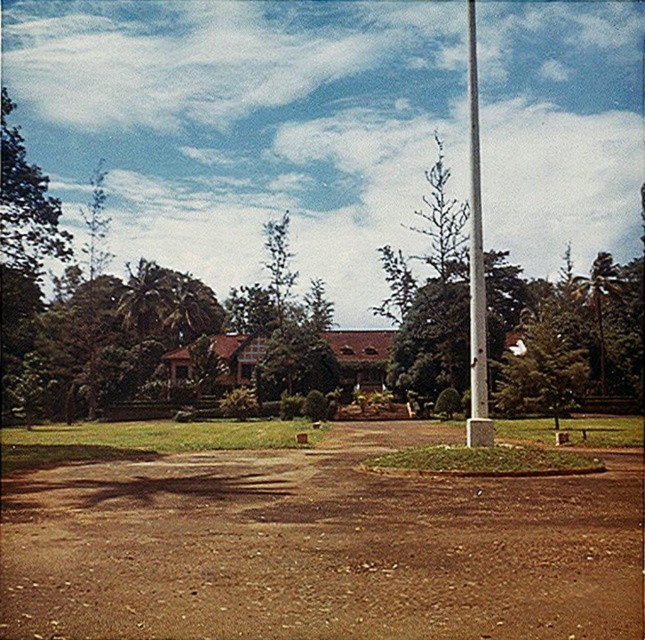
You are a gardener planning to plant a new flower bed between the brown dirt field at center and the green textured tree at center. Which object should you avoid digging near to prevent damaging its roots?

You should avoid digging near the green textured tree at center because it is taller than the brown dirt field at center, meaning it has deeper roots that could be damaged by digging.